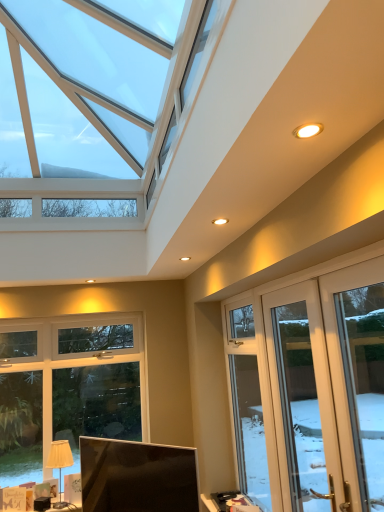
Question: From the image's perspective, is beige fabric lampshade at lower left under white glossy door at right, acting as the first screen door starting from the back?

Choices:
 (A) yes
 (B) no

Answer: (A)

Question: Considering the relative sizes of beige fabric lampshade at lower left and white glossy door at right, acting as the first screen door starting from the back, in the image provided, is beige fabric lampshade at lower left taller than white glossy door at right, acting as the first screen door starting from the back,?

Choices:
 (A) yes
 (B) no

Answer: (B)

Question: Does beige fabric lampshade at lower left appear on the right side of white glossy door at right, acting as the first screen door starting from the back?

Choices:
 (A) yes
 (B) no

Answer: (B)

Question: Can you confirm if beige fabric lampshade at lower left is shorter than white glossy door at right, acting as the first screen door starting from the back?

Choices:
 (A) no
 (B) yes

Answer: (B)

Question: Considering the relative positions of beige fabric lampshade at lower left and white glossy door at right, acting as the first screen door starting from the back, in the image provided, is beige fabric lampshade at lower left in front of white glossy door at right, acting as the first screen door starting from the back,?

Choices:
 (A) yes
 (B) no

Answer: (B)

Question: Is beige fabric lampshade at lower left aimed at white glossy door at right, the second screen door from the front?

Choices:
 (A) no
 (B) yes

Answer: (A)

Question: From the image's perspective, is clear glass door at right, placed as the first window when sorted from right to left, located above matte white screen door at lower right, positioned as the first screen door in front-to-back order?

Choices:
 (A) no
 (B) yes

Answer: (B)

Question: Are clear glass door at right, acting as the 1th window starting from the front, and matte white screen door at lower right, acting as the second screen door starting from the back, located far from each other?

Choices:
 (A) no
 (B) yes

Answer: (B)

Question: Considering the relative sizes of clear glass door at right, acting as the 1th window starting from the front, and matte white screen door at lower right, positioned as the first screen door in front-to-back order, in the image provided, is clear glass door at right, acting as the 1th window starting from the front, smaller than matte white screen door at lower right, positioned as the first screen door in front-to-back order,?

Choices:
 (A) no
 (B) yes

Answer: (B)

Question: Is clear glass door at right, which is the second window from back to front, bigger than matte white screen door at lower right, positioned as the first screen door in front-to-back order?

Choices:
 (A) yes
 (B) no

Answer: (B)

Question: From the image's perspective, would you say clear glass door at right, placed as the first window when sorted from right to left, is shown under matte white screen door at lower right, positioned as the first screen door in front-to-back order?

Choices:
 (A) no
 (B) yes

Answer: (A)

Question: From a real-world perspective, does clear glass door at right, which is the second window from back to front, stand above matte white screen door at lower right, positioned as the first screen door in front-to-back order?

Choices:
 (A) yes
 (B) no

Answer: (A)

Question: Is matte white screen door at lower right, acting as the second screen door starting from the back, next to beige fabric lampshade at lower left and touching it?

Choices:
 (A) yes
 (B) no

Answer: (B)